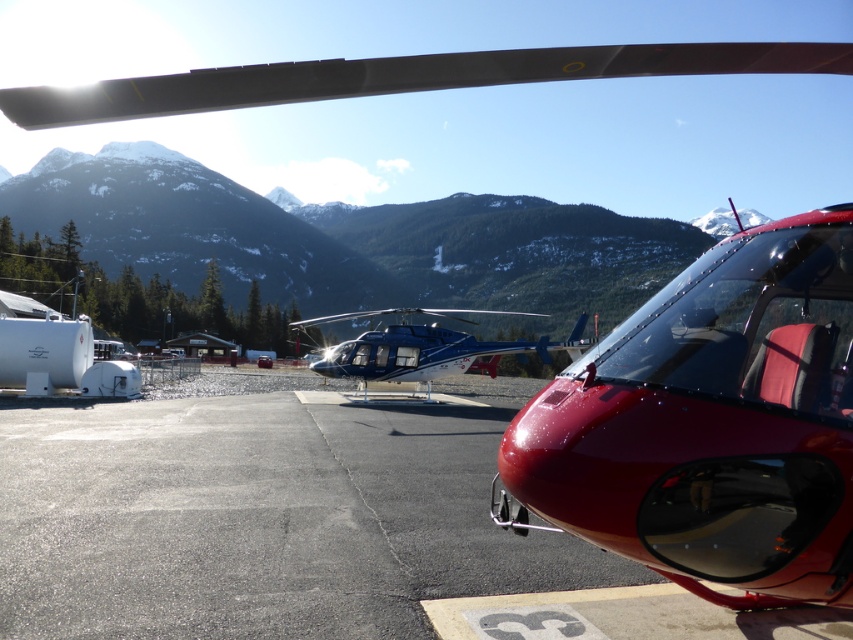
You are a pilot who needs to park your helicopter in the designated spot marked with the number 3. The shiny red helicopter at center is currently occupying the spot. Can you move your metallic blue helicopter at center into the spot without overlapping the red helicopter?

The shiny red helicopter at center has a smaller size compared to metallic blue helicopter at center. Since the metallic blue helicopter at center is larger, it might not fit in the designated spot marked with the number 3 which is currently occupied by the smaller shiny red helicopter at center. You may need to find another parking area.

You are a pilot who needs to board the shiny red helicopter at center. There is a metallic blue helicopter at center blocking the entrance. Can you safely move around it to reach the cockpit without getting too close? The minimum safe distance between the two helicopters is 10 meters.

The shiny red helicopter at center is 13.38 meters away from the metallic blue helicopter at center. Since the minimum safe distance is 10 meters, you can safely move around the metallic blue helicopter at center while maintaining the required distance.